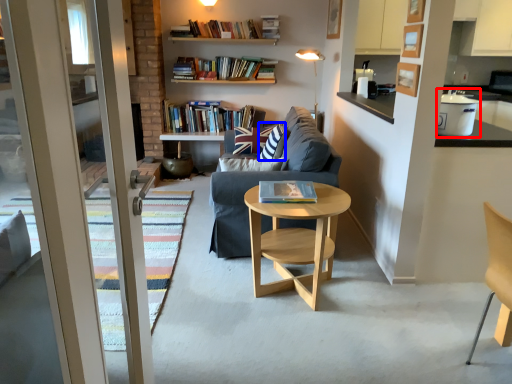
Question: Which object is closer to the camera taking this photo, appliance (highlighted by a red box) or pillow (highlighted by a blue box)?

Choices:
 (A) appliance
 (B) pillow

Answer: (A)